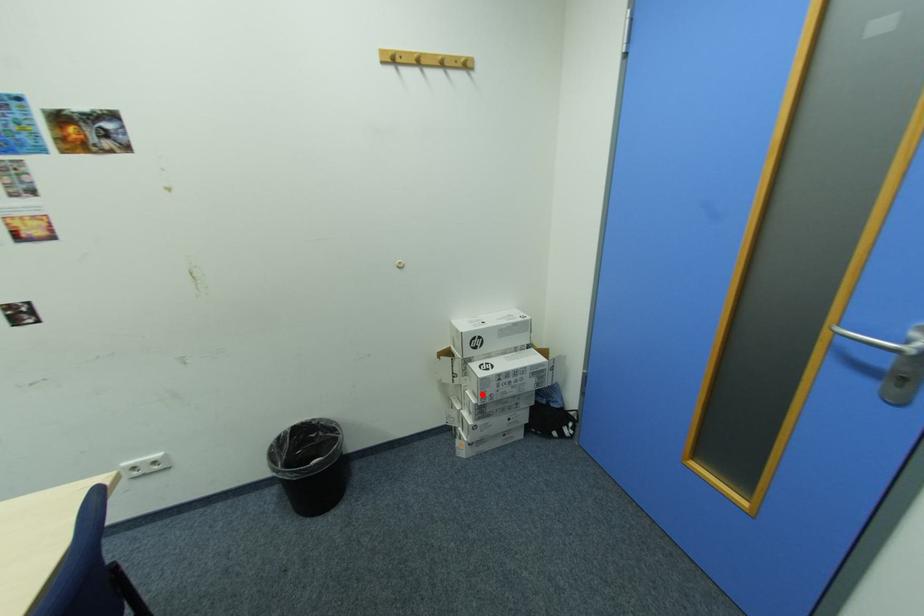
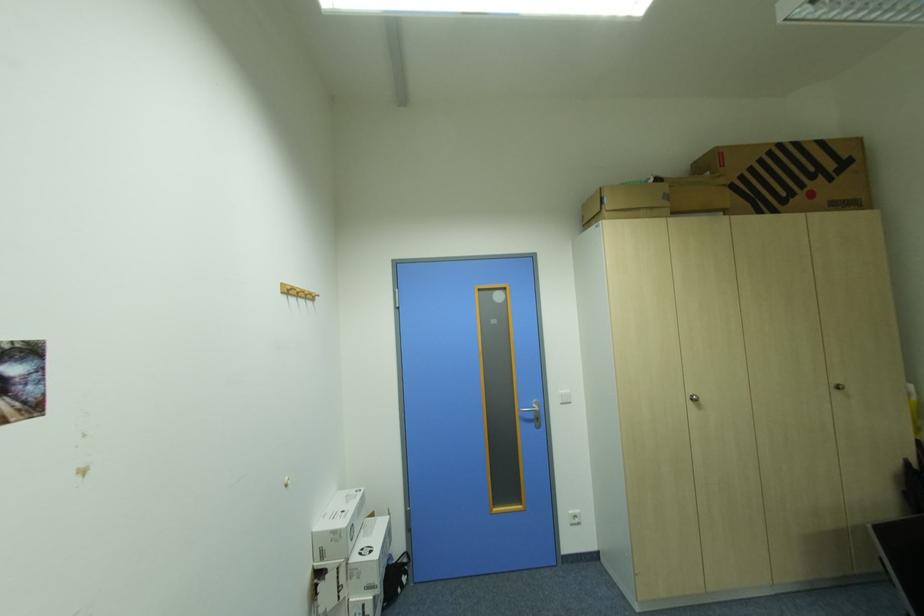
Question: A red point is marked in image1. In image2, is the corresponding 3D point closer to the camera or farther? Reply with the corresponding letter.

Choices:
 (A) The corresponding 3D point is closer.
 (B) The corresponding 3D point is farther.

Answer: (A)